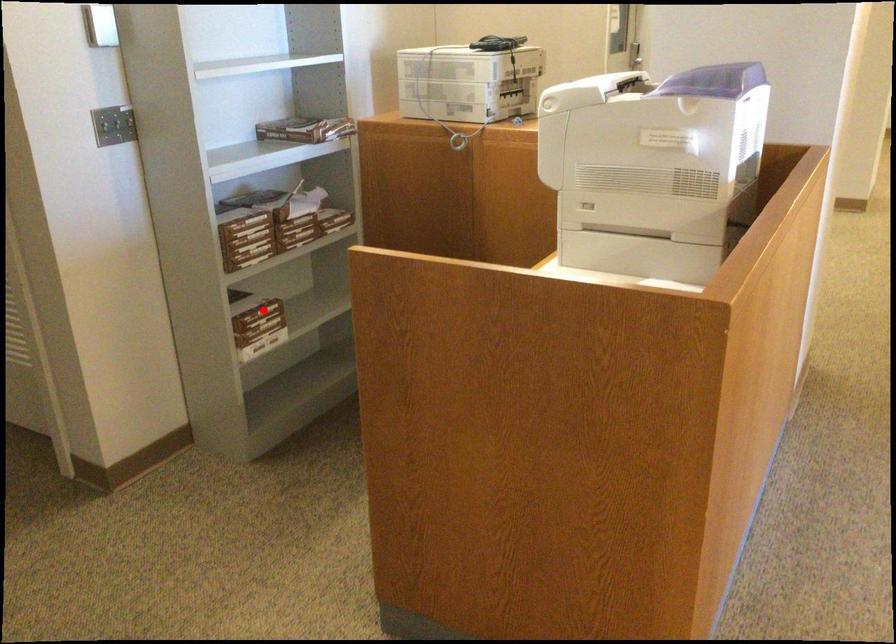
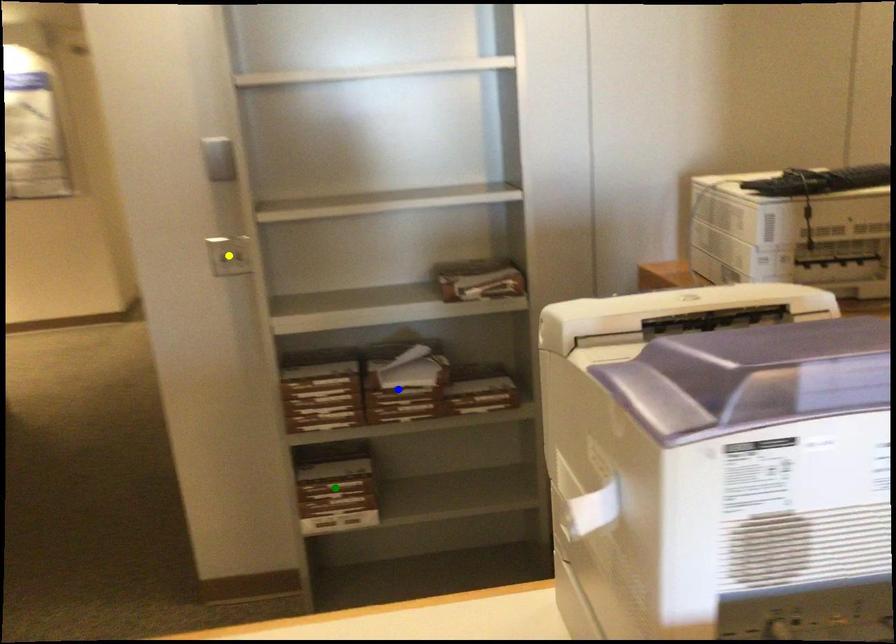
Question: I am providing you with two images of the same scene from different viewpoints. A red point is marked on the first image. You are given multiple points on the second image. Which spot in image 2 lines up with the point in image 1?

Choices:
 (A) blue point
 (B) green point
 (C) yellow point

Answer: (B)